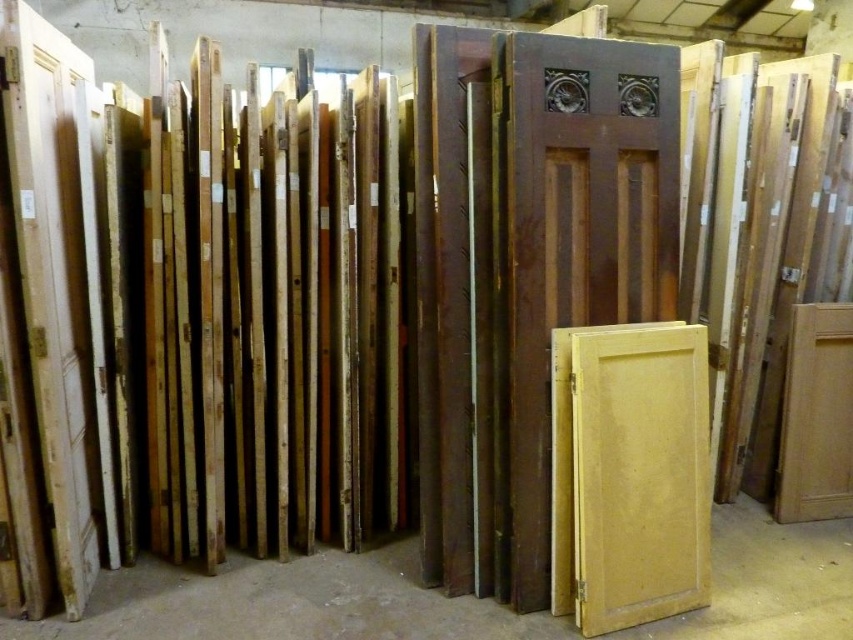
You are standing in the storage area and want to reach a specific point in the scene. The point is located at coordinates point (x=523, y=125). Can you estimate how far you need to walk to reach it?

The point (x=523, y=125) is 2.19 meters from the camera, so you need to walk approximately 2.19 meters to reach it.

You are an interior designer planning to install two doors in a modern minimalist living room. The matte brown wooden door at center and the light yellow wood door at center are options. Considering their sizes, which door would be more suitable for a taller entranceway?

The matte brown wooden door at center is much taller than the light yellow wood door at center, making it more suitable for a taller entranceway.